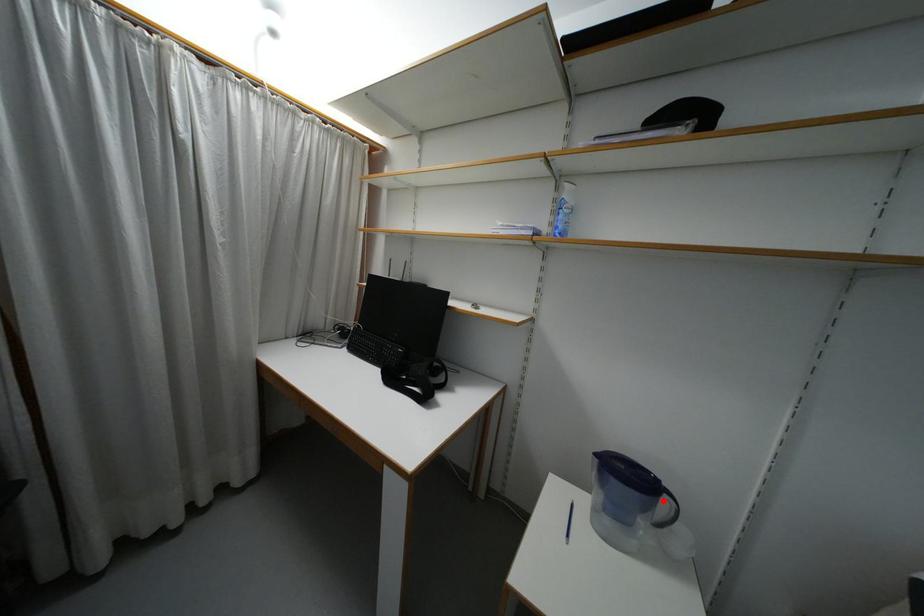
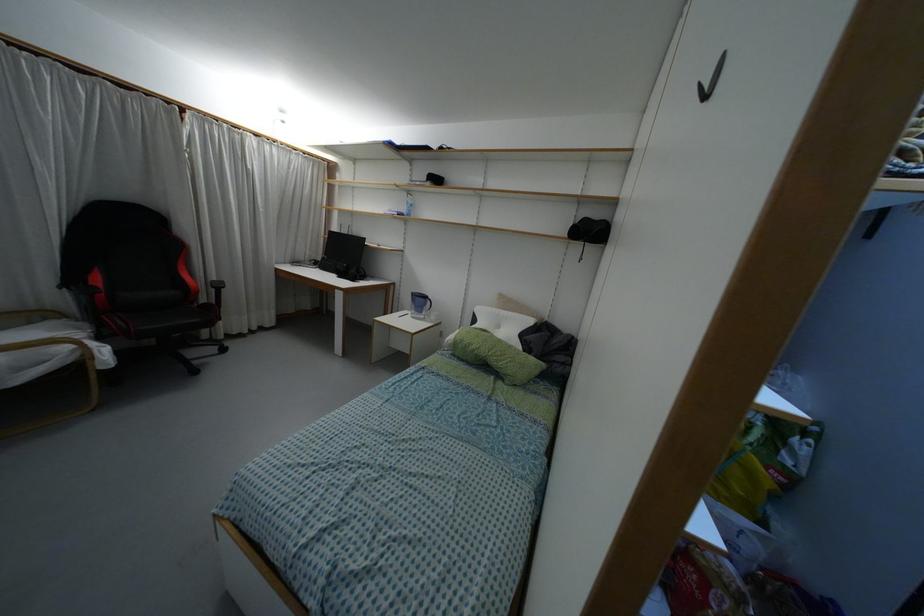
The point at the highlighted location is marked in the first image. Where is the corresponding point in the second image?

(428, 302)